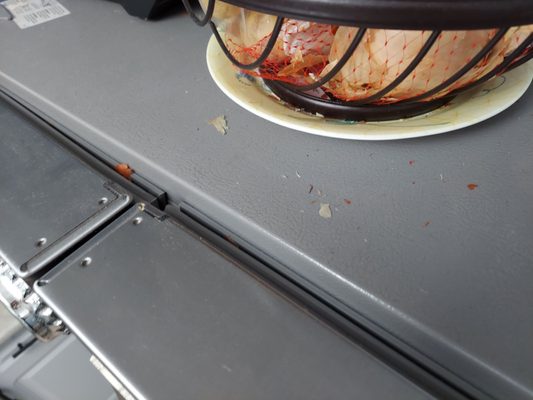
Identify the location of plate. (486, 118).